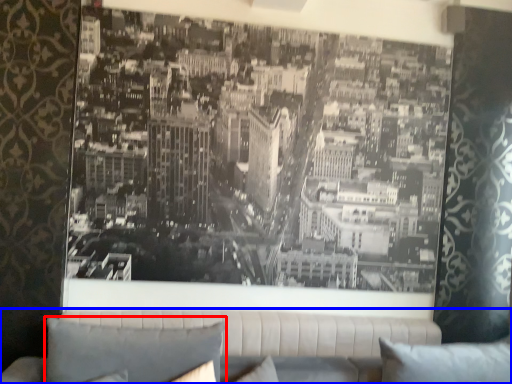
Question: Which object is closer to the camera taking this photo, pillow (highlighted by a red box) or studio couch (highlighted by a blue box)?

Choices:
 (A) pillow
 (B) studio couch

Answer: (A)